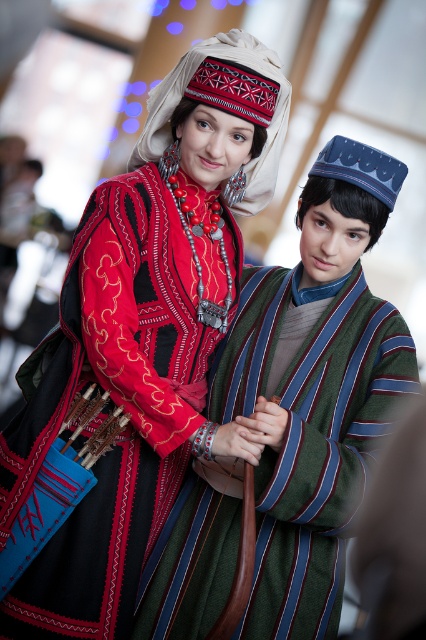
Question: From the image, what is the correct spatial relationship of striped wool robe at center in relation to embroidered fabric headdress at upper center?

Choices:
 (A) right
 (B) left

Answer: (A)

Question: Can you confirm if striped wool robe at center is wider than embroidered fabric headdress at upper center?

Choices:
 (A) yes
 (B) no

Answer: (A)

Question: Does striped wool robe at center have a smaller size compared to embroidered fabric headdress at upper center?

Choices:
 (A) no
 (B) yes

Answer: (A)